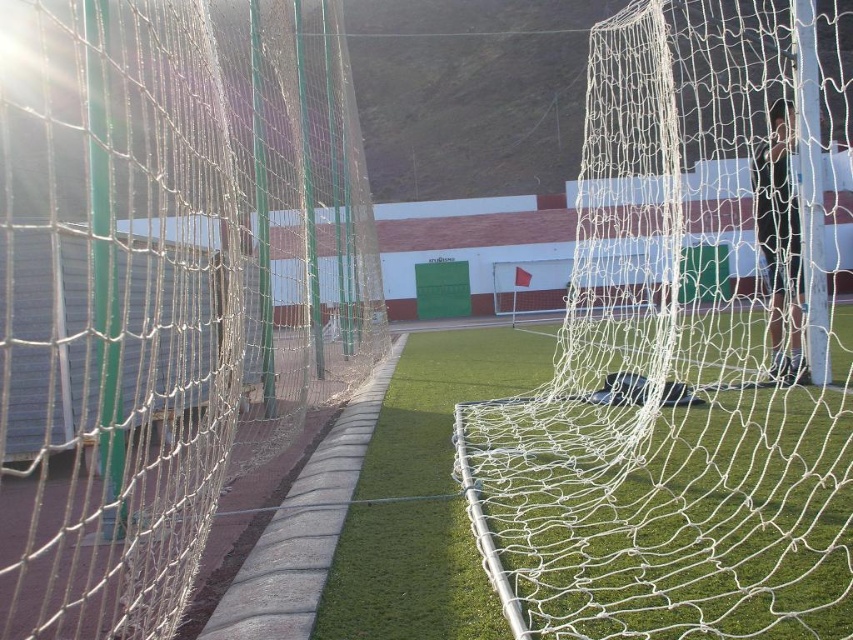
Question: Which of the following is the closest to the observer?

Choices:
 (A) (421, 339)
 (B) (103, 138)

Answer: (B)

Question: Is white mesh net at left wider than green artificial turf at center?

Choices:
 (A) yes
 (B) no

Answer: (A)

Question: Which object appears farthest from the camera in this image?

Choices:
 (A) green artificial turf at center
 (B) black fabric man at center
 (C) white mesh net at center

Answer: (B)

Question: Does white mesh net at left have a lesser width compared to black fabric man at center?

Choices:
 (A) no
 (B) yes

Answer: (A)

Question: Does white mesh net at left appear on the left side of black fabric man at center?

Choices:
 (A) yes
 (B) no

Answer: (A)

Question: Which point is farther to the camera?

Choices:
 (A) white mesh net at left
 (B) green artificial turf at center
 (C) white mesh net at center

Answer: (B)